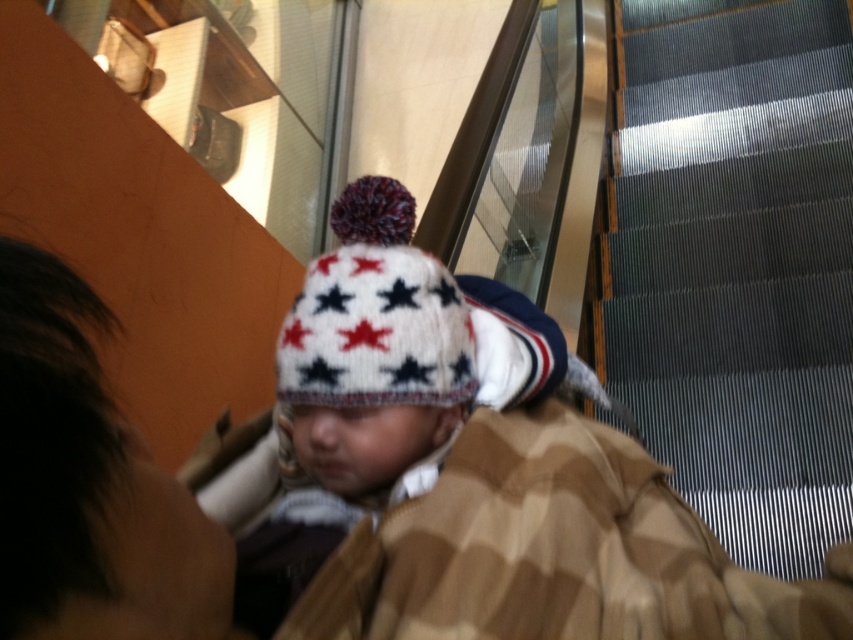
Question: Considering the relative positions of metallic gray stairs at right and white knitted hat at center in the image provided, where is metallic gray stairs at right located with respect to white knitted hat at center?

Choices:
 (A) right
 (B) left

Answer: (A)

Question: Is metallic gray stairs at right further to camera compared to white knitted hat at center?

Choices:
 (A) yes
 (B) no

Answer: (A)

Question: Is metallic gray stairs at right thinner than white knitted hat at center?

Choices:
 (A) yes
 (B) no

Answer: (B)

Question: Which point is farther from the camera taking this photo?

Choices:
 (A) (x=389, y=413)
 (B) (x=833, y=362)

Answer: (B)